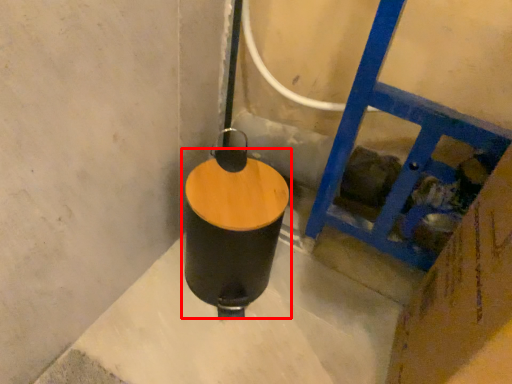
Question: From the image's perspective, what is the correct spatial positioning of waste container (annotated by the red box) in reference to ladder?

Choices:
 (A) below
 (B) above

Answer: (B)